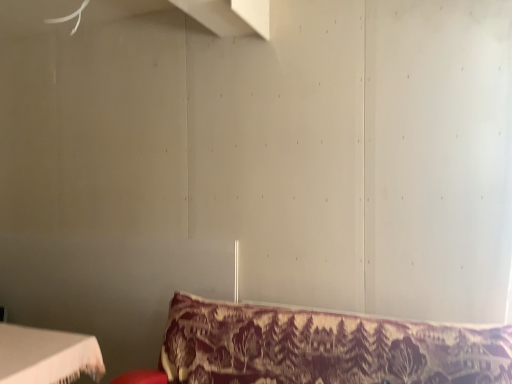
Find the location of a particular element. velvet-like fabric couch at lower right is located at coordinates (319, 348).

The width and height of the screenshot is (512, 384). What do you see at coordinates (319, 348) in the screenshot? I see `velvet-like fabric couch at lower right` at bounding box center [319, 348].

Identify the location of velvet-like fabric couch at lower right. Image resolution: width=512 pixels, height=384 pixels. (319, 348).